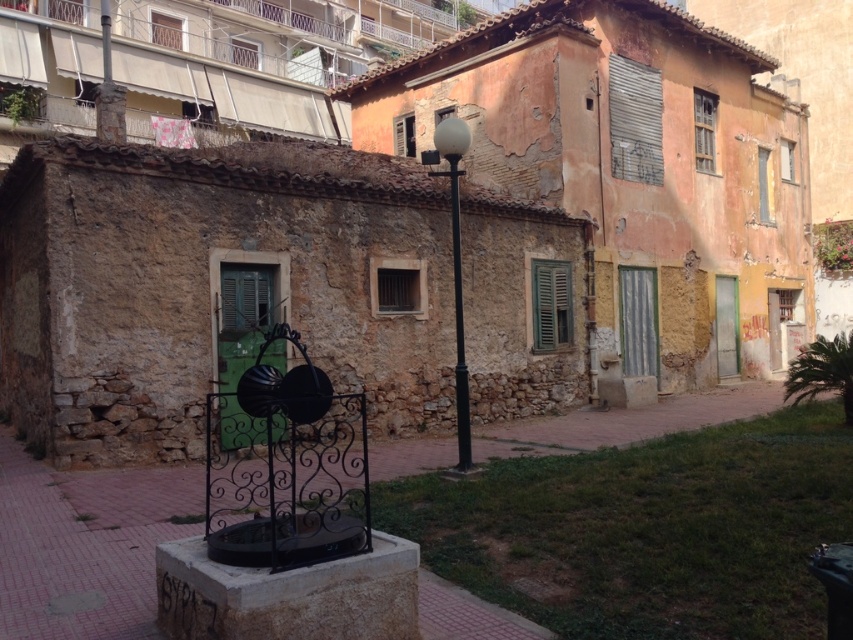
Question: Which of the following is the closest to the observer?

Choices:
 (A) (239, 285)
 (B) (654, 360)

Answer: (A)

Question: Based on their relative distances, which object is farther from the green matte shutters at center?

Choices:
 (A) metallic silver shutter at upper right
 (B) brown wooden shutter at center

Answer: (A)

Question: Where is brown wooden shutter at center located in relation to wooden at upper right in the image?

Choices:
 (A) below
 (B) above

Answer: (A)

Question: Which is nearer to the metallic silver shutter at upper right?

Choices:
 (A) brown wooden shutter at center
 (B) black metal lamp post at center
 (C) green matte shutters at center

Answer: (C)

Question: Does metallic silver shutter at upper right lie in front of green matte shutter at center?

Choices:
 (A) no
 (B) yes

Answer: (A)

Question: Is the position of green matte shutter at center more distant than that of wooden at upper right?

Choices:
 (A) yes
 (B) no

Answer: (B)